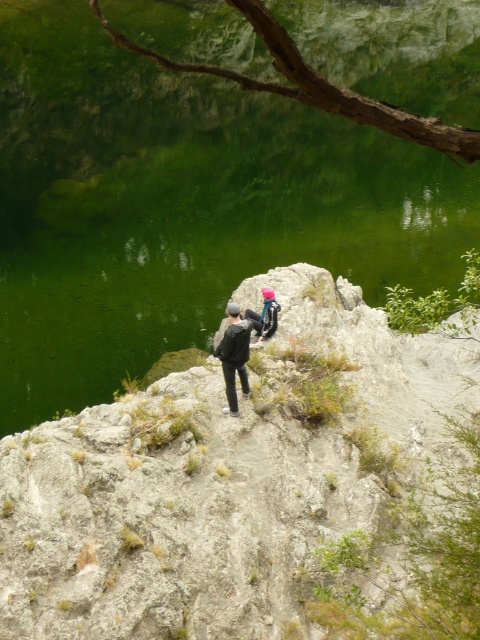
You are standing at the edge of the rocky outcrop overlooking the water. You see two points marked on the scene. The first point is at coordinates point (433, 497) and the second is at point (240, 369). If you want to move from the first point to the second point, which direction should you move relative to your current position?

To move from point (433, 497) to point (240, 369), you should move backward since point (433, 497) is in front of point (240, 369).

You are planning to take a photo of the gray rocky hillside at center and the pink fabric backpack at center from the left side of the scene. Which object will appear on the right side of your photo?

The gray rocky hillside at center is to the right of the pink fabric backpack at center, so in the photo taken from the left side of the scene, the gray rocky hillside at center will appear on the right side.